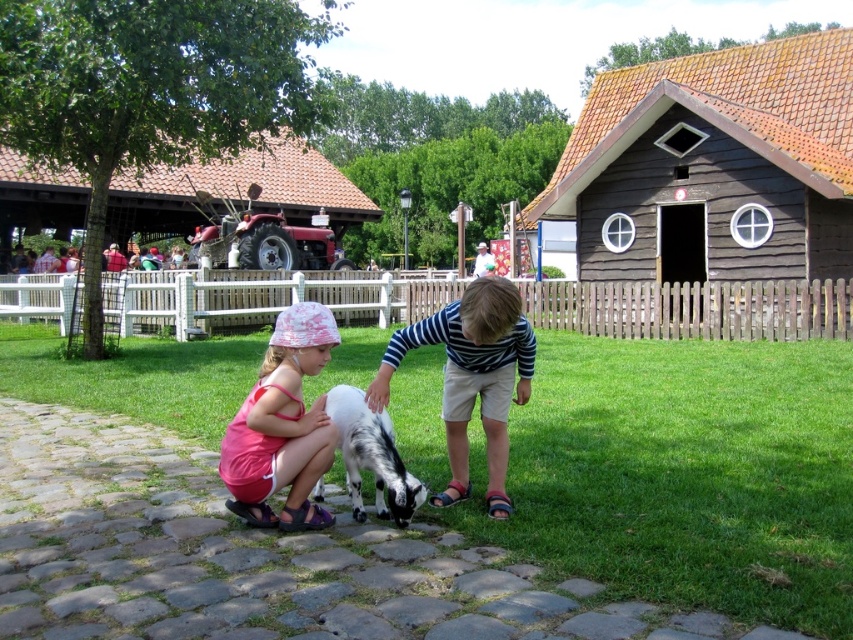
Question: Where is green grass at center located in relation to striped cotton shirt at center in the image?

Choices:
 (A) right
 (B) left

Answer: (B)

Question: Is brown wooden hut at upper right above striped cotton shirt at center?

Choices:
 (A) no
 (B) yes

Answer: (B)

Question: Which point appears farthest from the camera in this image?

Choices:
 (A) (355, 445)
 (B) (485, 413)

Answer: (B)

Question: Considering the real-world distances, which object is closest to the green grass at center?

Choices:
 (A) pink fabric hat at lower left
 (B) white soft fur goat at center
 (C) brown wooden hut at upper right

Answer: (B)

Question: Which point is farther to the camera?

Choices:
 (A) (738, 90)
 (B) (457, 454)

Answer: (A)

Question: Is brown wooden hut at upper right wider than pink fabric hat at lower left?

Choices:
 (A) yes
 (B) no

Answer: (A)